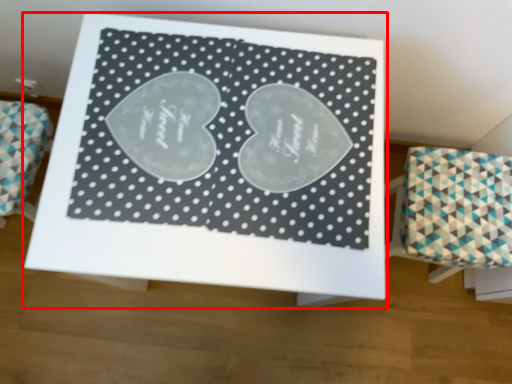
Question: From the image, what is the correct spatial relationship of table (annotated by the red box) in relation to furniture?

Choices:
 (A) right
 (B) left

Answer: (B)